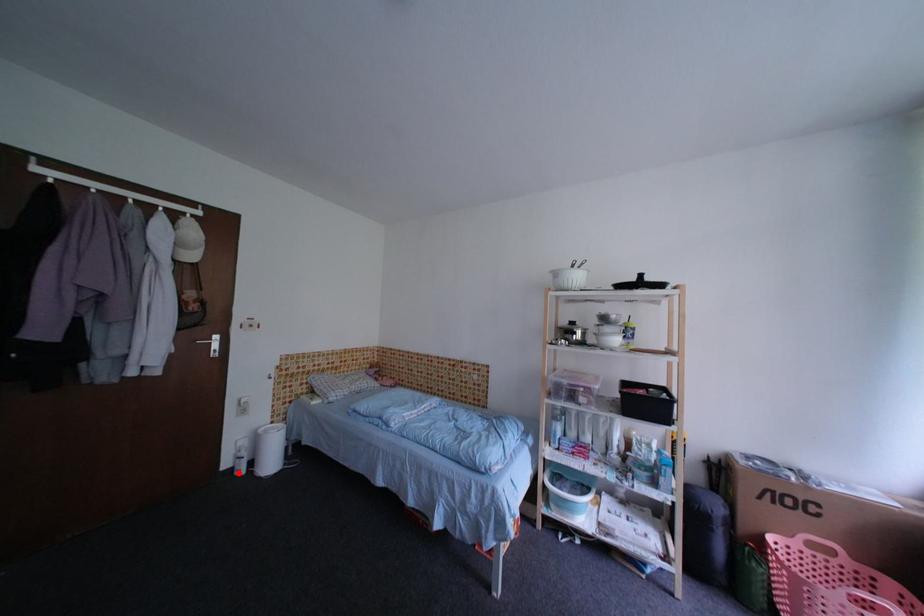
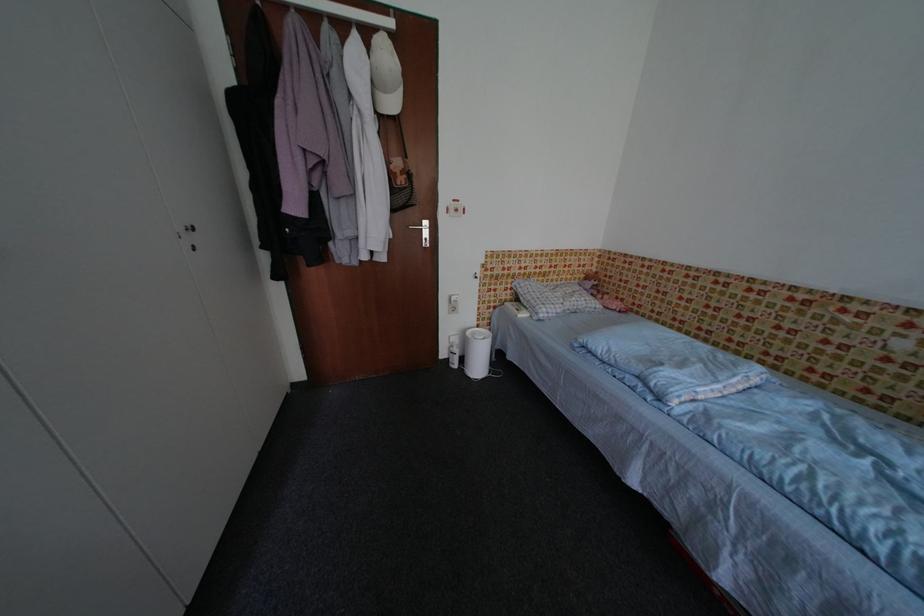
Find the pixel in the second image that matches the highlighted location in the first image.

(455, 363)